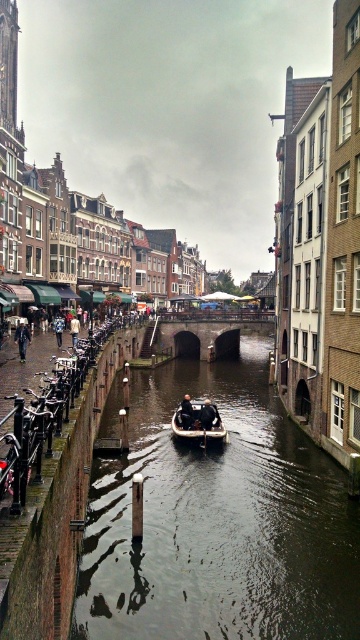
You are a tourist standing on the cobblestone street beside the canal. You see a white plastic boat at center and a dark brown leather jacket at lower left. Which object is closer to you?

The white plastic boat at center is closer to you because it is in front of the dark brown leather jacket at lower left.

You are standing at a viewpoint overlooking the canal scene. You want to take a photo of the point at coordinates point (183, 400) in the image. If your camera has a maximum focus range of 300 feet, will it be able to focus on that point?

The distance of point (183, 400) from the camera is 298.60 feet, which is within the camera maximum focus range of 300 feet. Therefore, the camera can focus on that point.